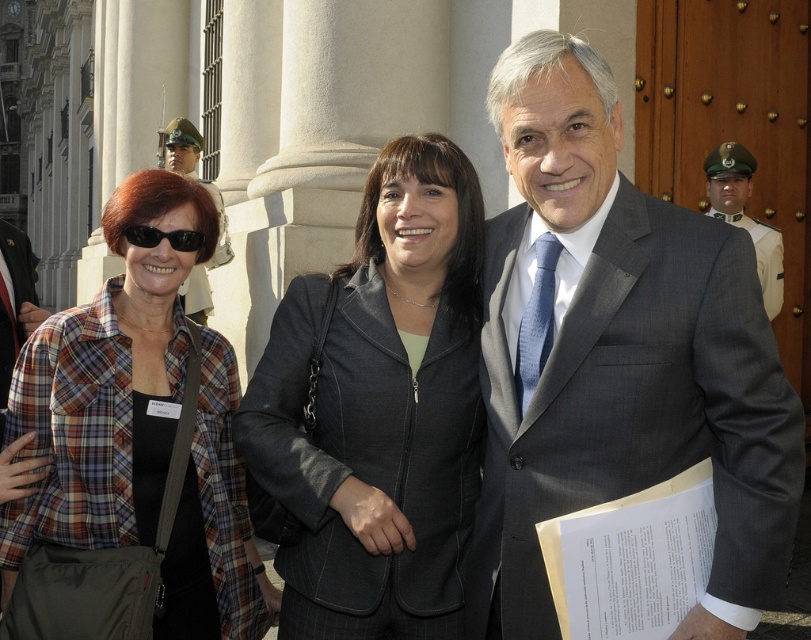
Image resolution: width=811 pixels, height=640 pixels. Describe the element at coordinates (744, 216) in the screenshot. I see `green uniformed guard at center` at that location.

Can you confirm if green uniformed guard at center is wider than black plastic sunglasses at upper left?

No, green uniformed guard at center is not wider than black plastic sunglasses at upper left.

Is point (719, 198) more distant than point (200, 236)?

Yes, point (719, 198) is farther from viewer.

Where is `green uniformed guard at center`? This screenshot has width=811, height=640. green uniformed guard at center is located at coordinates (744, 216).

Which of these two, gray suit at center or green uniformed guard at center, stands shorter?

green uniformed guard at center

Which is below, gray suit at center or green uniformed guard at center?

gray suit at center is below.

Is point (599, 477) closer to viewer compared to point (752, 156)?

Yes, it is.

This screenshot has width=811, height=640. I want to click on gray suit at center, so click(616, 356).

Can you confirm if gray suit at center is shorter than matte black jacket at left?

In fact, gray suit at center may be taller than matte black jacket at left.

Based on the photo, can you confirm if gray suit at center is positioned to the right of matte black jacket at left?

Yes, gray suit at center is to the right of matte black jacket at left.

Locate an element on the screen. gray suit at center is located at coordinates (616, 356).